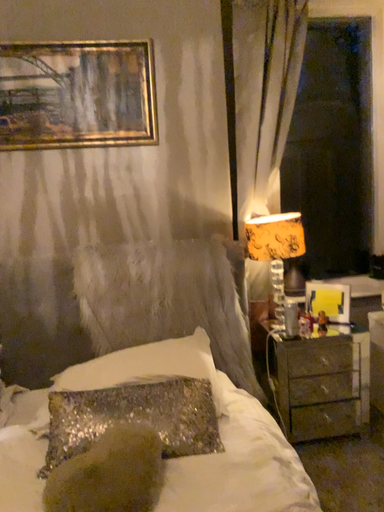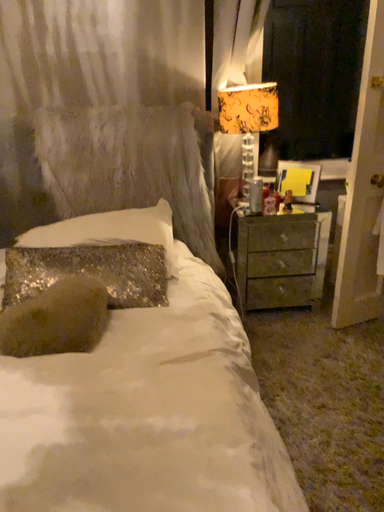
Question: Which way did the camera rotate in the video?

Choices:
 (A) rotated upward
 (B) rotated downward

Answer: (B)